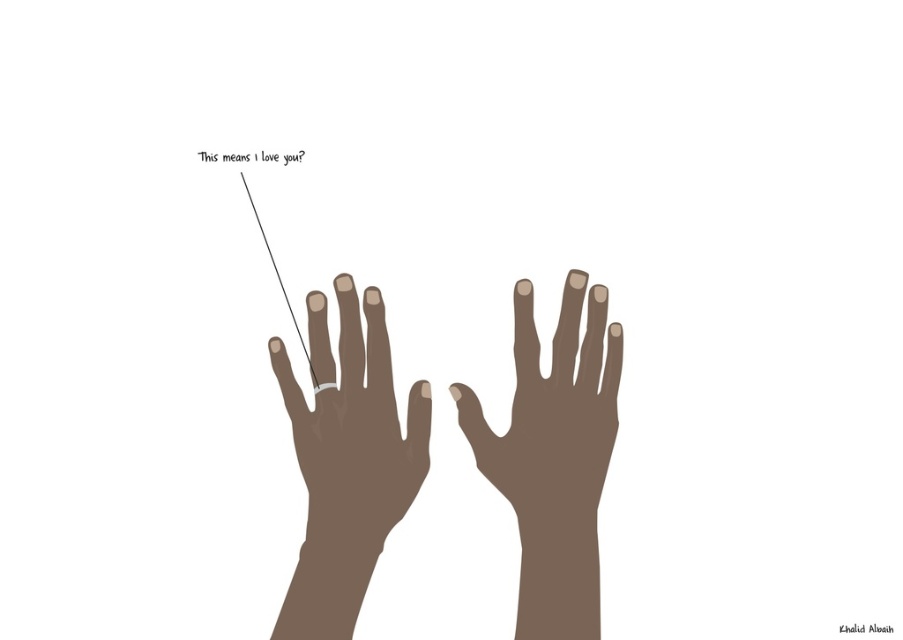
Between matte silver ring at left and brown matte hand at center, which one appears on the right side from the viewer's perspective?

brown matte hand at center

Is matte silver ring at left positioned before brown matte hand at center?

Yes.

Locate an element on the screen. This screenshot has height=640, width=903. matte silver ring at left is located at coordinates (355, 435).